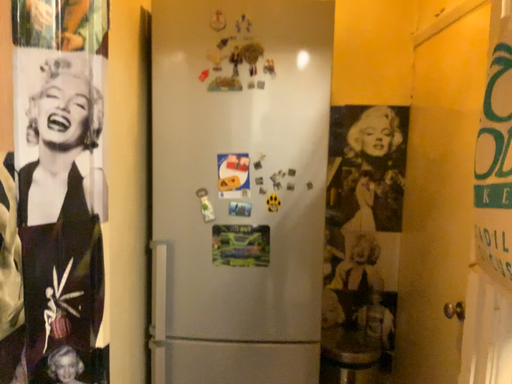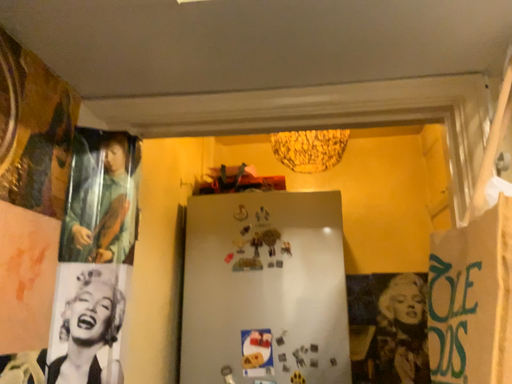
Question: Which way did the camera rotate in the video?

Choices:
 (A) rotated right
 (B) rotated left

Answer: (B)